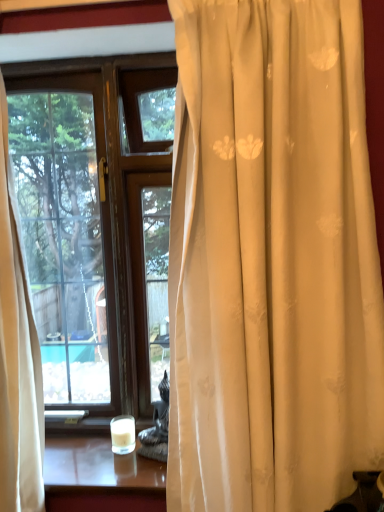
Question: Can black textured statue at lower center be found inside white glass candle at lower center?

Choices:
 (A) no
 (B) yes

Answer: (A)

Question: Considering the relative positions of white glass candle at lower center and black textured statue at lower center in the image provided, is white glass candle at lower center to the right of black textured statue at lower center from the viewer's perspective?

Choices:
 (A) no
 (B) yes

Answer: (A)

Question: From a real-world perspective, is white glass candle at lower center under black textured statue at lower center?

Choices:
 (A) yes
 (B) no

Answer: (A)

Question: From the image's perspective, is white glass candle at lower center under black textured statue at lower center?

Choices:
 (A) no
 (B) yes

Answer: (B)

Question: Could you tell me if white glass candle at lower center is turned towards black textured statue at lower center?

Choices:
 (A) yes
 (B) no

Answer: (B)

Question: Is white glass candle at lower center not near black textured statue at lower center?

Choices:
 (A) no
 (B) yes

Answer: (A)

Question: Is black textured statue at lower center facing away from white glass candle at lower center?

Choices:
 (A) no
 (B) yes

Answer: (A)

Question: From the image's perspective, does black textured statue at lower center appear lower than white glass candle at lower center?

Choices:
 (A) no
 (B) yes

Answer: (A)

Question: Is black textured statue at lower center oriented towards white glass candle at lower center?

Choices:
 (A) yes
 (B) no

Answer: (B)

Question: Would you say black textured statue at lower center is outside white glass candle at lower center?

Choices:
 (A) yes
 (B) no

Answer: (A)

Question: Would you say white glass candle at lower center is part of black textured statue at lower center's contents?

Choices:
 (A) no
 (B) yes

Answer: (A)

Question: From a real-world perspective, does black textured statue at lower center sit lower than white glass candle at lower center?

Choices:
 (A) no
 (B) yes

Answer: (A)

Question: In the image, is black textured statue at lower center positioned in front of or behind white glass candle at lower center?

Choices:
 (A) behind
 (B) front

Answer: (B)